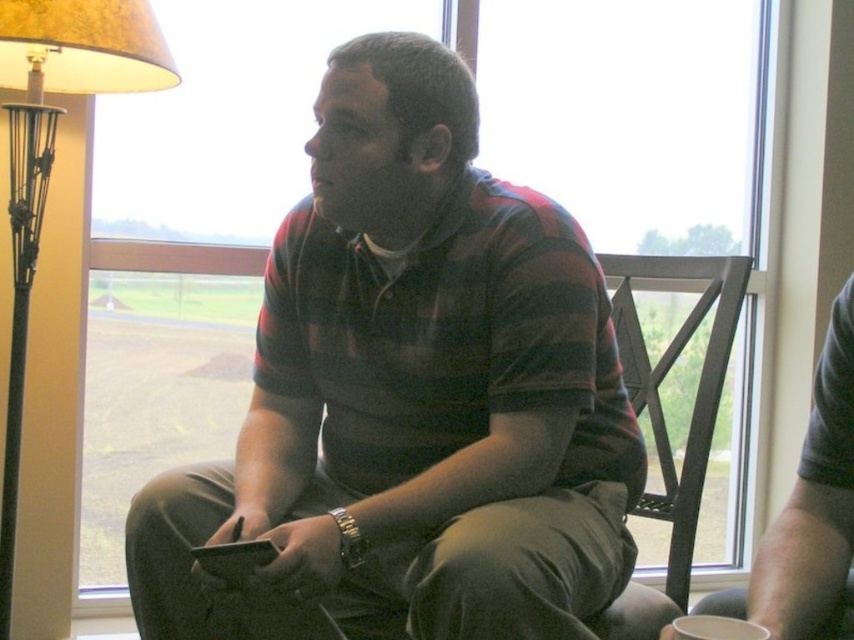
Can you confirm if metallic gold lamp at left is shorter than gray fabric shirt at center?

In fact, metallic gold lamp at left may be taller than gray fabric shirt at center.

Between metallic gold lamp at left and gray fabric shirt at center, which one has less height?

gray fabric shirt at center

Is point (75, 56) closer to viewer compared to point (822, 518)?

No, it is behind (822, 518).

Find the location of a particular element. This screenshot has width=854, height=640. metallic gold lamp at left is located at coordinates (53, 160).

From the picture: Does striped cotton shirt at center have a smaller size compared to dark brown leather armchair at center?

Yes.

Between striped cotton shirt at center and dark brown leather armchair at center, which one has less height?

dark brown leather armchair at center is shorter.

Is point (334, 136) more distant than point (652, 410)?

That is False.

This screenshot has height=640, width=854. Find the location of `striped cotton shirt at center`. striped cotton shirt at center is located at coordinates (413, 392).

Is dark brown leather armchair at center to the left of black metal chair at right from the viewer's perspective?

No, dark brown leather armchair at center is not to the left of black metal chair at right.

Who is shorter, dark brown leather armchair at center or black metal chair at right?

Standing shorter between the two is black metal chair at right.

Find the location of a particular element. dark brown leather armchair at center is located at coordinates (664, 412).

The image size is (854, 640). I want to click on dark brown leather armchair at center, so click(664, 412).